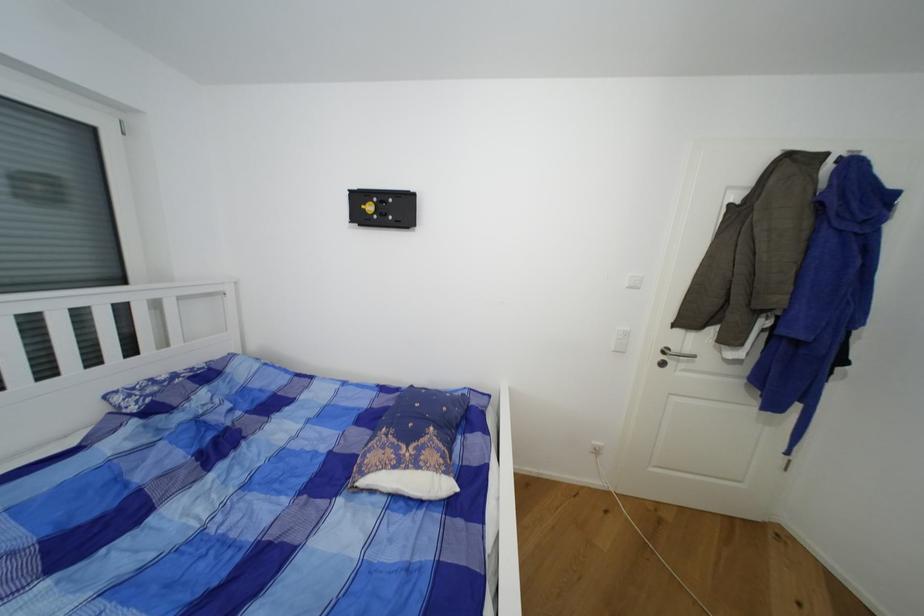
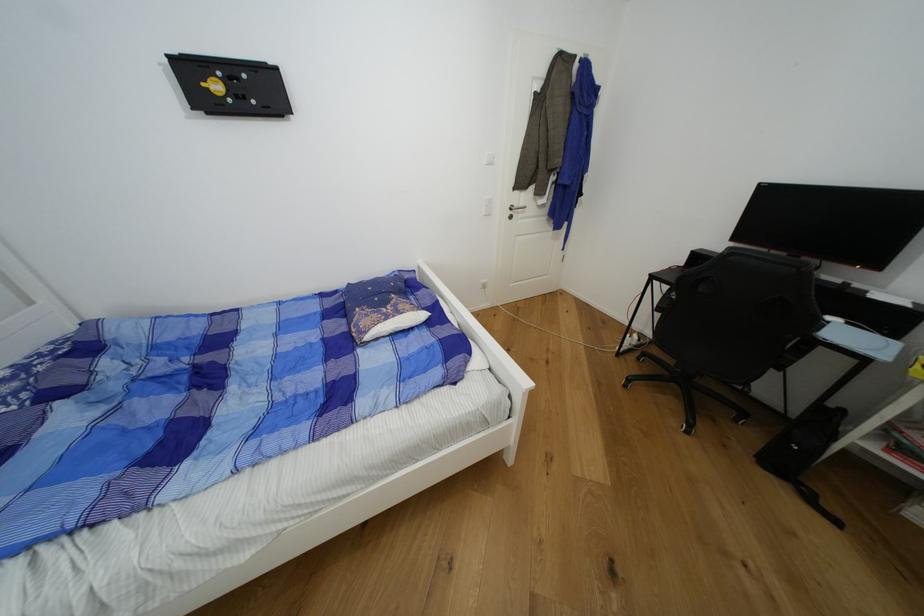
In the second image, find the point that corresponds to (681,351) in the first image.

(521, 207)